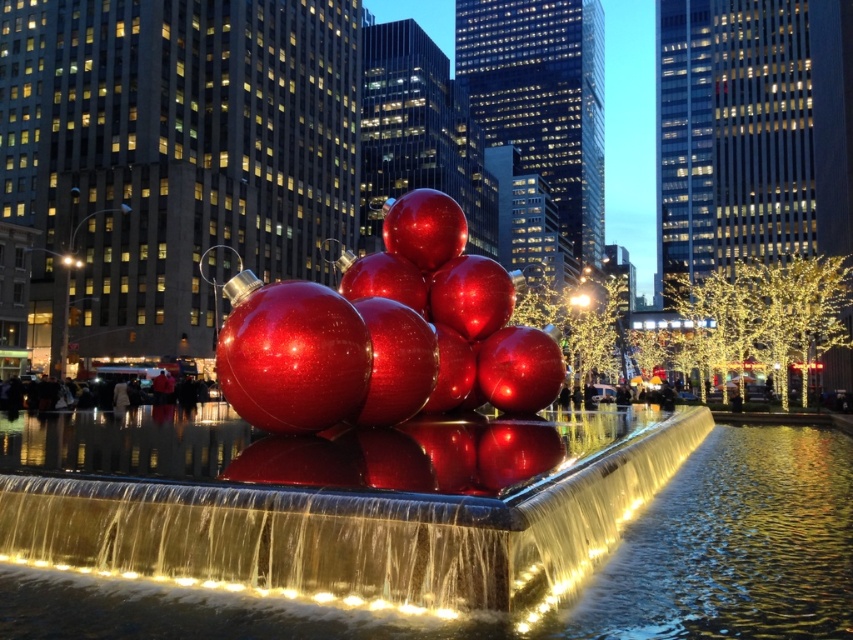
You are standing in front of the fountain and see two points marked in the image. Which point, point (329, 410) or point (811, 445), is closer to you?

Point (329, 410) is closer to the viewer than point (811, 445).

You are standing in front of the fountain and want to place a small decorative stone on the right side of the glossy metallic fountain at center. Will the stone be placed to the right of the glossy metallic water at center?

The glossy metallic fountain at center is positioned on the left side of the glossy metallic water at center. Therefore, placing the stone to the right of the glossy metallic fountain at center would place it to the right of the glossy metallic water at center as well.

You are standing at the center of the image and want to walk towards the glossy metallic fountain at center. Which direction should you move in terms of the coordinate system provided?

The glossy metallic fountain at center is located at point [376,445], so you should move towards the coordinates [376,445] to reach it.